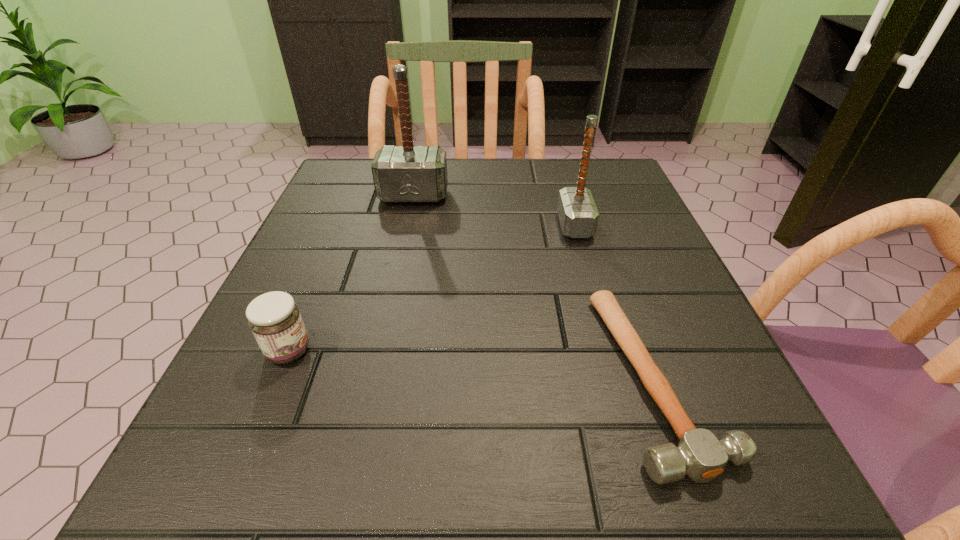
What are the coordinates of `empty space that is in between the leftmost hammer and the shortest hammer` in the screenshot? It's located at click(x=536, y=287).

Locate an element on the screen. free space between the second farthest object and the tallest object is located at coordinates (494, 211).

Find the location of a particular element. The width and height of the screenshot is (960, 540). free spot between the shortest hammer and the second shortest object is located at coordinates pyautogui.click(x=473, y=364).

Locate an element on the screen. The width and height of the screenshot is (960, 540). vacant space that is in between the shortest object and the leftmost object is located at coordinates (473, 364).

Identify the location of free space between the second nearest hammer and the farthest hammer. (494, 211).

Locate an element on the screen. This screenshot has width=960, height=540. object that stands as the closest to the second object from left to right is located at coordinates (578, 215).

Select which object is the closest to the third object from right to left. Please provide its 2D coordinates. Your answer should be formatted as a tuple, i.e. [(x, y)], where the tuple contains the x and y coordinates of a point satisfying the conditions above.

[(578, 215)]

Locate an element on the screen. hammer that stands as the closest to the third shortest object is located at coordinates point(699,454).

Choose which hammer is the second nearest neighbor to the farthest object. Please provide its 2D coordinates. Your answer should be formatted as a tuple, i.e. [(x, y)], where the tuple contains the x and y coordinates of a point satisfying the conditions above.

[(699, 454)]

The width and height of the screenshot is (960, 540). In order to click on vacant space that satisfies the following two spatial constraints: 1. on the striking surface of the second tallest hammer; 2. on the right side of the shortest object in this screenshot , I will do `click(618, 377)`.